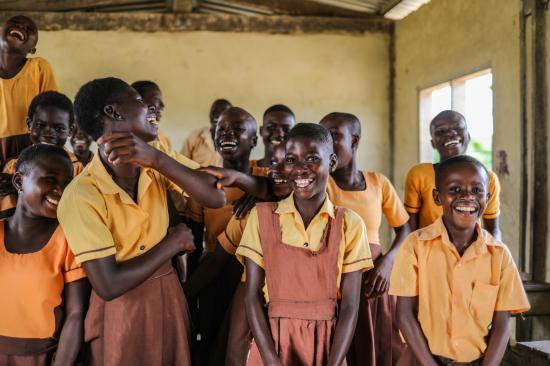
Locate an element on the screen. The image size is (550, 366). window is located at coordinates (473, 88).